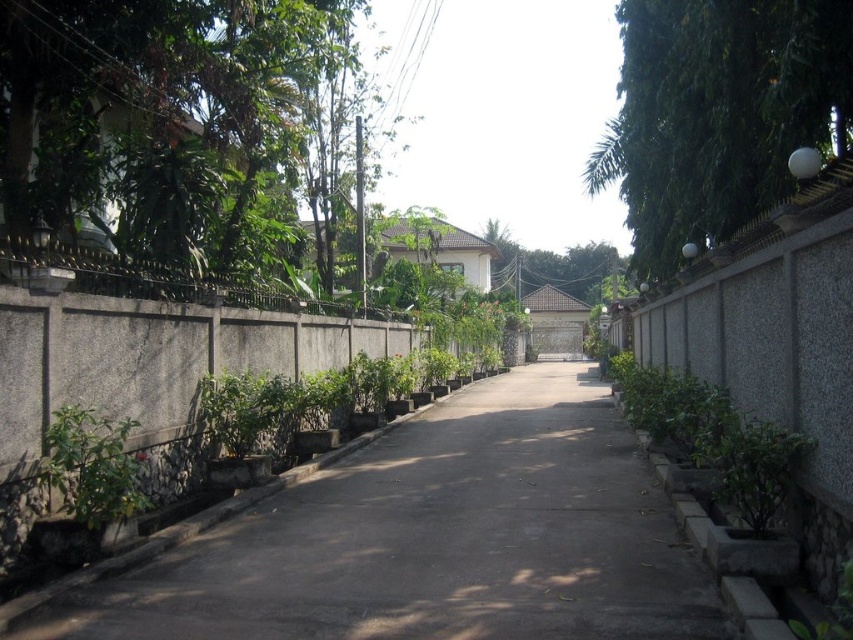
Can you confirm if green leafy tree at left is shorter than green leafy plant at lower left?

Incorrect, green leafy tree at left's height does not fall short of green leafy plant at lower left's.

Is point (160, 19) more distant than point (53, 435)?

Yes, it is behind point (53, 435).

I want to click on green leafy tree at left, so click(x=163, y=120).

Locate an element on the screen. green leafy tree at left is located at coordinates (163, 120).

Between gray concrete pavement at center and green leafy tree at center, which one has more height?

Standing taller between the two is green leafy tree at center.

Which of these two, gray concrete pavement at center or green leafy tree at center, stands shorter?

gray concrete pavement at center is shorter.

This screenshot has height=640, width=853. What do you see at coordinates (436, 538) in the screenshot?
I see `gray concrete pavement at center` at bounding box center [436, 538].

You are a GUI agent. You are given a task and a screenshot of the screen. Output one action in this format:
    pyautogui.click(x=<x>, y=<y>)
    Task: Click on the gray concrete pavement at center
    This screenshot has height=640, width=853.
    Given the screenshot: What is the action you would take?
    pyautogui.click(x=436, y=538)

Does point (495, 470) lie in front of point (119, 509)?

No, (495, 470) is behind (119, 509).

Consider the image. Is the position of gray concrete pavement at center less distant than that of green leafy plant at lower left?

Yes, it is in front of green leafy plant at lower left.

Find the location of a particular element. Image resolution: width=853 pixels, height=640 pixels. gray concrete pavement at center is located at coordinates (436, 538).